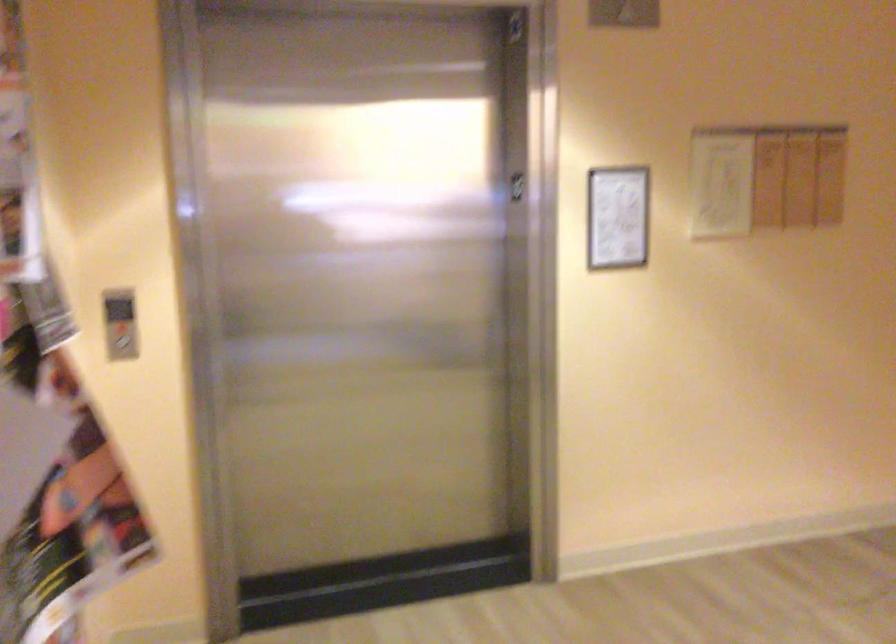
At what (x,y) coordinates should I click in order to perform the action: click on elevator call button. Please return your answer as a coordinate pair (x, y). Looking at the image, I should click on (x=122, y=343).